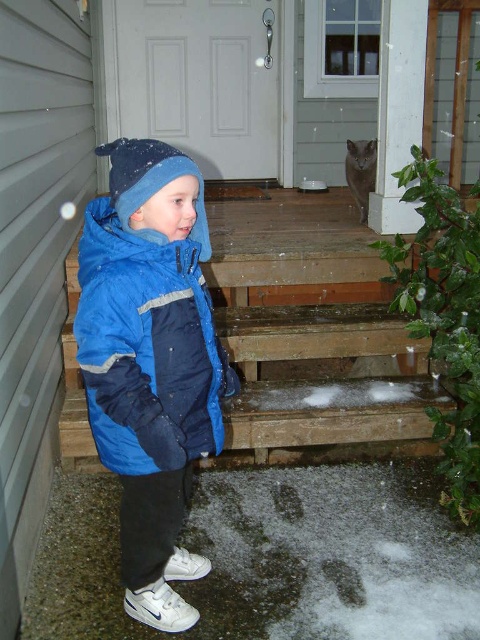
Is point (177, 444) positioned in front of point (409, 435)?

Yes.

You are a GUI agent. You are given a task and a screenshot of the screen. Output one action in this format:
    pyautogui.click(x=<x>, y=<y>)
    Task: Click on the blue fleece jacket at left
    The height and width of the screenshot is (640, 480).
    Given the screenshot: What is the action you would take?
    pyautogui.click(x=151, y=362)